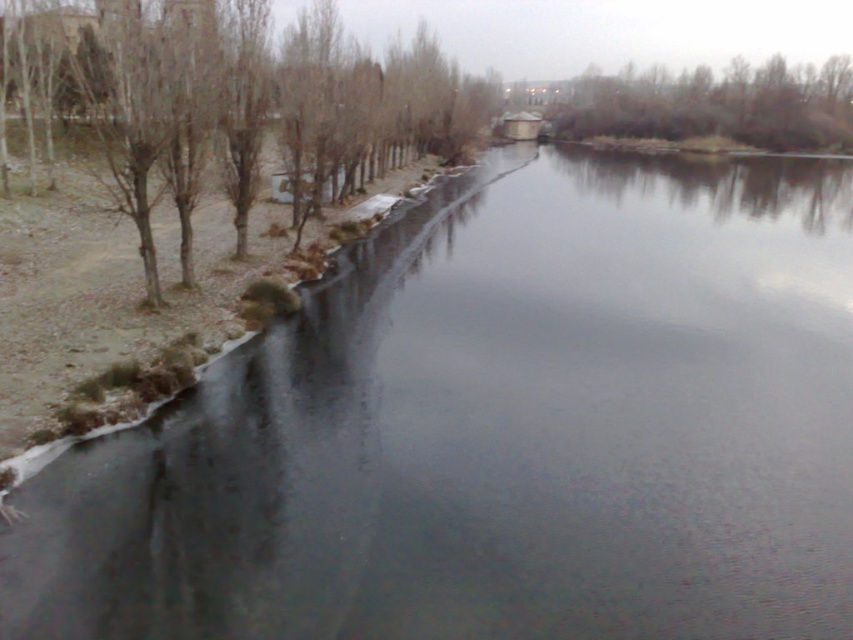
You are standing on the riverside path and notice the bare branches at left and the brown textured tree at upper right. Which of these two objects is closer to the ground?

The bare branches at left is positioned under the brown textured tree at upper right, so it is closer to the ground.

You are an artist planning to sketch the riverside scene. You notice the bare branches at left and the brown textured tree at upper right. Which object should you draw first if you want to focus on the thinner structure?

You should draw the bare branches at left first because it is thinner than the brown textured tree at upper right.